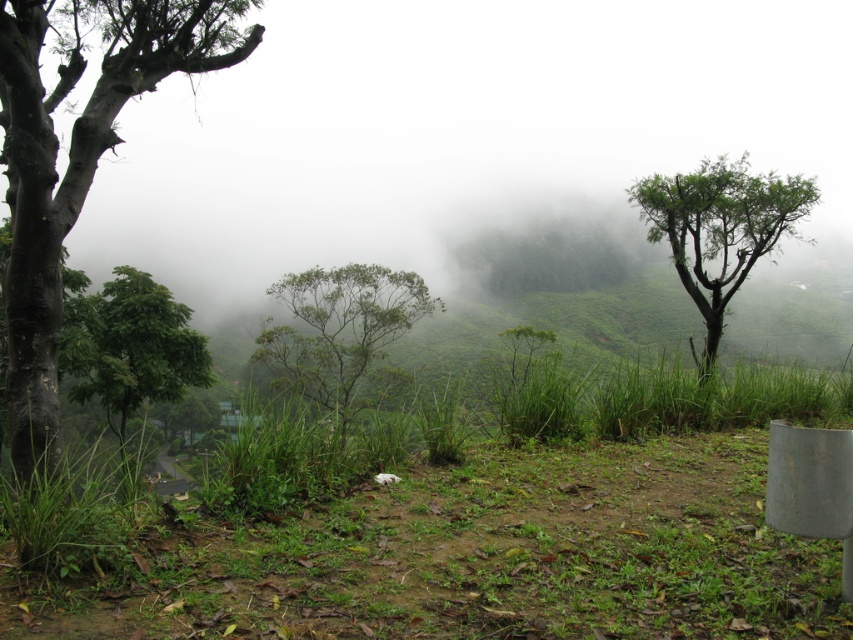
You are an environmental scientist assessing the health of trees in a misty landscape. You observe the green leafy tree at right and the green leafy tree at center. Which tree has a narrower width, and what might this indicate about its growth conditions?

The green leafy tree at right has a lesser width compared to the green leafy tree at center. This narrower width might indicate that the tree at right has experienced restricted growth, possibly due to limited resources like sunlight, nutrients, or space, or it could be a younger tree still in its developmental stage.

You are an observer standing in the misty landscape scene. You notice two trees labeled as the green leafy tree at right and the green leafy tree at lower left. Which tree appears to be closer to you based on their positions?

The green leafy tree at right is positioned over the green leafy tree at lower left, indicating it is closer to the observer.

You are navigating through the misty landscape and want to reach a specific location. You have two points marked on your map, point 1 at coordinates (283,380) and point 2 at (137,292). According to the image, which point is farther away from your current position?

Point 1 at coordinates (283,380) is farther away from your current position because it is positioned behind point 2 at (137,292).